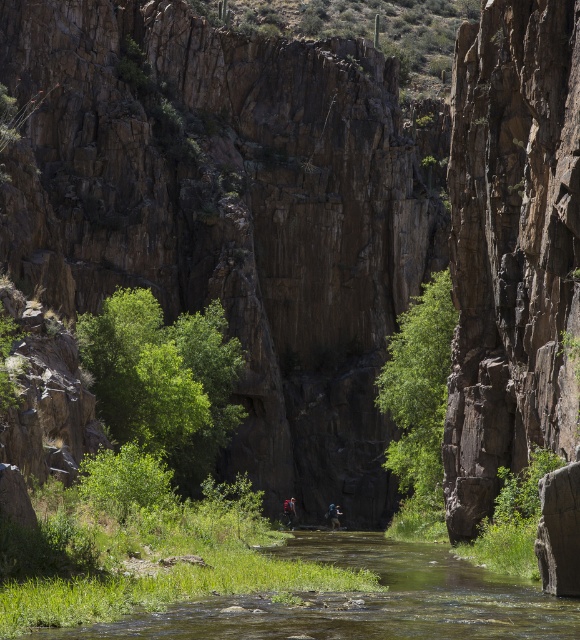
In the scene shown: Which is more to the right, green grassy stream at center or blue fabric backpack at center?

green grassy stream at center is more to the right.

Which is above, green grassy stream at center or blue fabric backpack at center?

green grassy stream at center is above.

In order to click on green grassy stream at center in this screenshot , I will do `click(361, 600)`.

Between point (280, 602) and point (292, 499), which one is positioned behind?

Positioned behind is point (292, 499).

Between point (371, 592) and point (284, 515), which one is positioned in front?

Positioned in front is point (371, 592).

Find the location of a particular element. This screenshot has height=640, width=580. green grassy stream at center is located at coordinates coord(361,600).

How much distance is there between camouflage fabric backpack at center and blue fabric backpack at center?

A distance of 23.68 feet exists between camouflage fabric backpack at center and blue fabric backpack at center.

Between camouflage fabric backpack at center and blue fabric backpack at center, which one appears on the left side from the viewer's perspective?

Positioned to the left is camouflage fabric backpack at center.

Image resolution: width=580 pixels, height=640 pixels. I want to click on camouflage fabric backpack at center, so click(290, 513).

At what (x,y) coordinates should I click in order to perform the action: click on camouflage fabric backpack at center. Please return your answer as a coordinate pair (x, y). The image size is (580, 640). Looking at the image, I should click on click(290, 513).